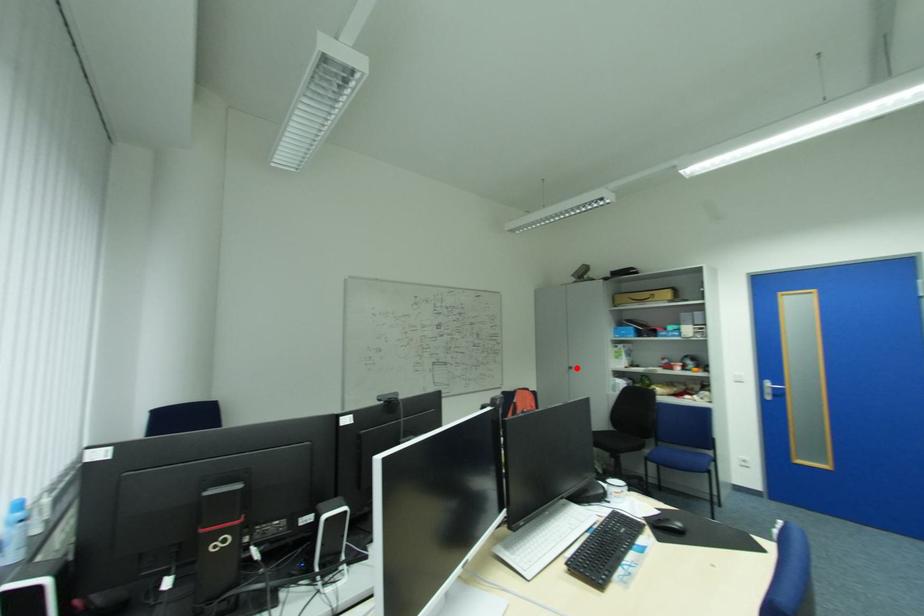
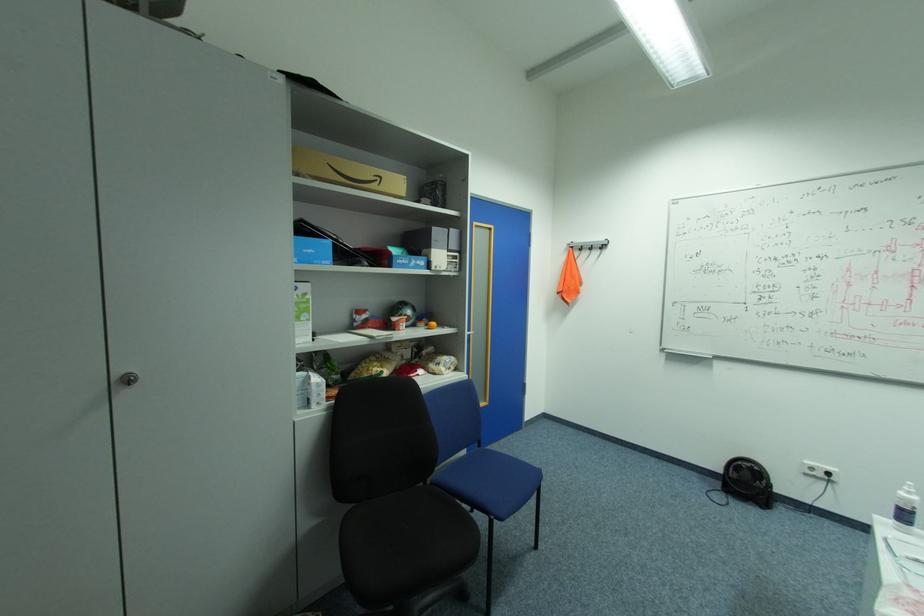
Where in the second image is the point corresponding to the highlighted location from the first image?

(137, 379)